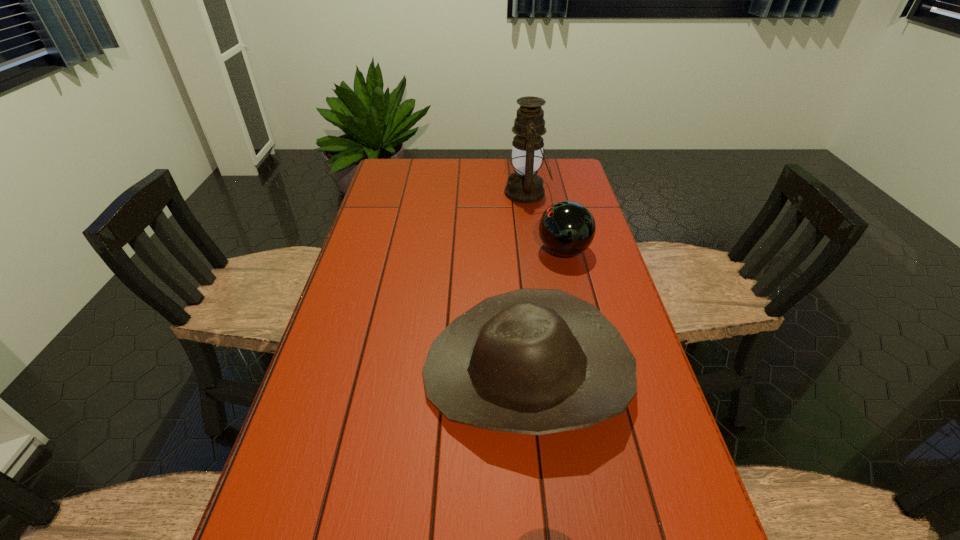
Where is `oil lamp present at the right edge`? oil lamp present at the right edge is located at coordinates (524, 186).

At what (x,y) coordinates should I click in order to perform the action: click on cowboy hat present at the right edge. Please return your answer as a coordinate pair (x, y). The image size is (960, 540). Looking at the image, I should click on (533, 361).

Where is `bowling ball that is at the right edge`? This screenshot has width=960, height=540. bowling ball that is at the right edge is located at coordinates (567, 228).

Identify the location of object that is at the far right corner. (524, 186).

In the image, there is a desktop. At what (x,y) coordinates should I click in order to perform the action: click on vacant space at the far edge. Please return your answer as a coordinate pair (x, y). Looking at the image, I should click on (490, 165).

Image resolution: width=960 pixels, height=540 pixels. In the image, there is a desktop. What are the coordinates of `vacant space at the left edge` in the screenshot? It's located at (375, 227).

Where is `free space at the right edge of the desktop`? The image size is (960, 540). free space at the right edge of the desktop is located at coordinates (x=660, y=428).

Locate an element on the screen. unoccupied position between the farthest object and the cowboy hat is located at coordinates (527, 282).

The width and height of the screenshot is (960, 540). What are the coordinates of `vacant space in between the nearest object and the farthest object` in the screenshot? It's located at pyautogui.click(x=527, y=282).

Identify which object is located as the nearest to the oil lamp. Please provide its 2D coordinates. Your answer should be formatted as a tuple, i.e. [(x, y)], where the tuple contains the x and y coordinates of a point satisfying the conditions above.

[(567, 228)]